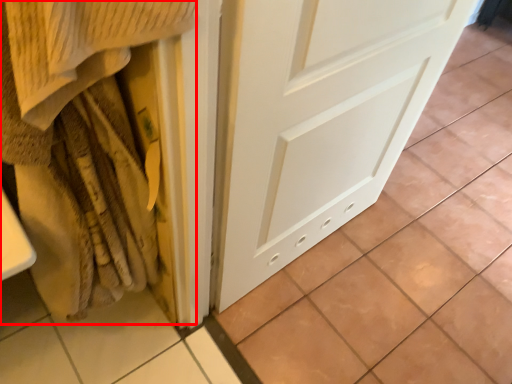
Question: From the image's perspective, where is blanket (annotated by the red box) located in relation to door in the image?

Choices:
 (A) below
 (B) above

Answer: (A)